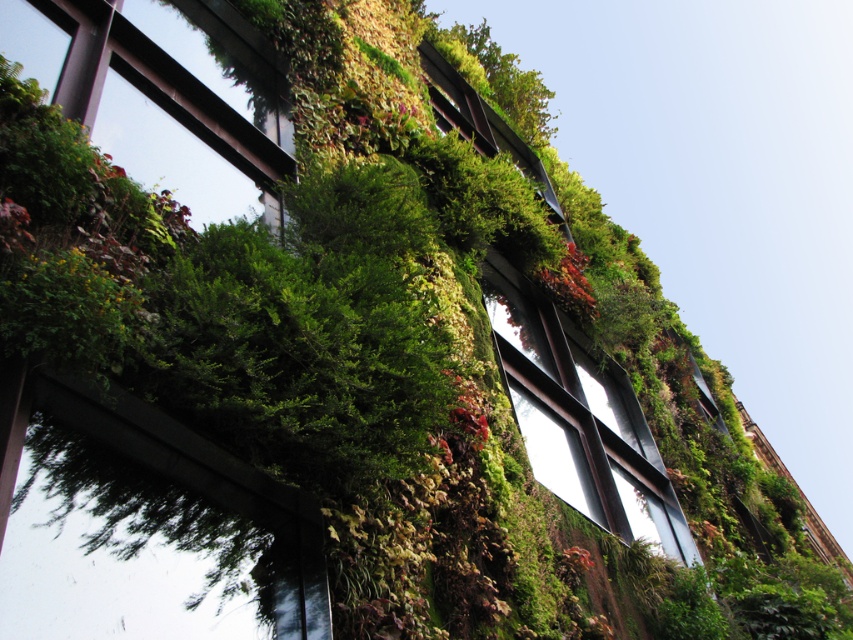
In the scene shown: Between metallic glass window at center and green matte window at upper left, which one is positioned lower?

metallic glass window at center is below.

Can you confirm if metallic glass window at center is shorter than green matte window at upper left?

In fact, metallic glass window at center may be taller than green matte window at upper left.

Is point (567, 464) positioned behind point (265, 163)?

Yes, it is behind point (265, 163).

In order to click on metallic glass window at center in this screenshot , I will do `click(579, 417)`.